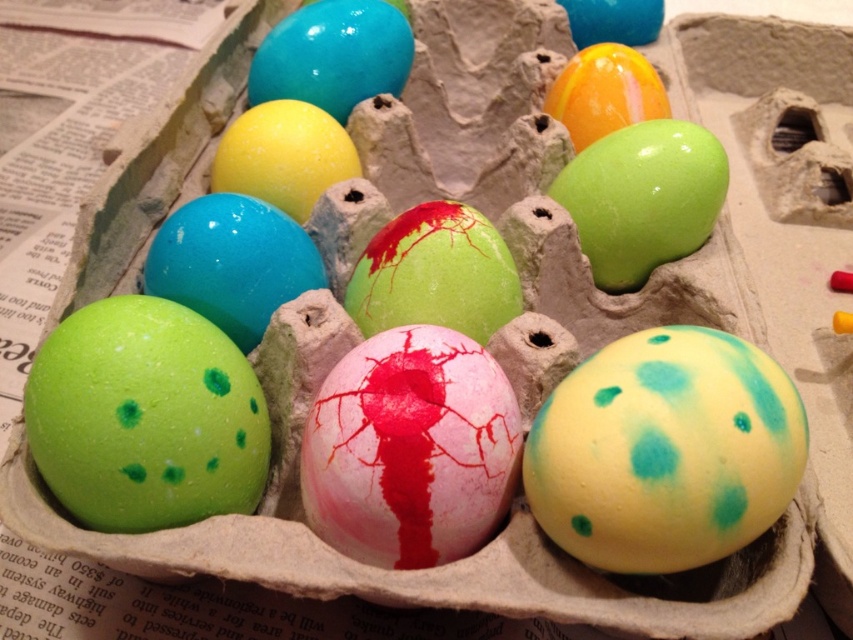
You are looking at the egg carton with two points marked on it. Which point, point (709,371) or point (222,196), is closer to you?

Point (709,371) is closer to the viewer than point (222,196).

You have a small container that can only hold eggs with a width of 4 cm or less. You need to place either the matte pink egg at center or the matte yellow egg at center into it. Which egg can fit into the container?

The matte yellow egg at center can fit into the container because its width is smaller than the matte pink egg at center, and since the container can hold eggs up to 4 cm, the yellow egg likely meets the size requirement.

You are holding a camera at a distance of 32.38 inches from the point marked as point (x=120, y=477) in the image. If you want to take a photo of the eggs in the carton, will you be able to capture the entire carton in the frame?

The point marked as point (x=120, y=477) is 32.38 inches away from the camera. Since the carton is the main subject in the image and the distance is specified, it is possible to capture the entire carton in the frame if the camera has an appropriate focal length and angle of view to encompass the entire carton at that distance.